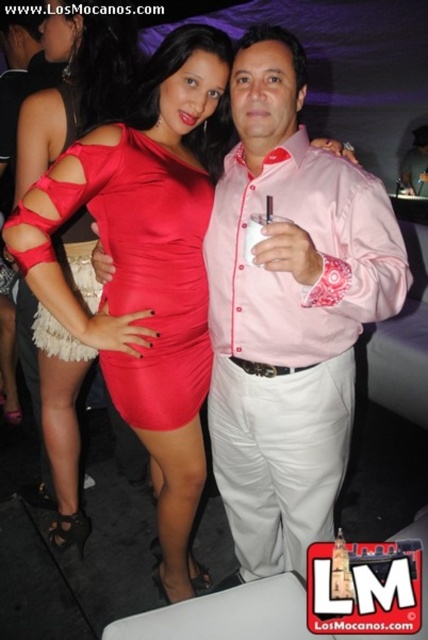
Is pink satin shirt at center to the right of satin dress at center from the viewer's perspective?

Correct, you'll find pink satin shirt at center to the right of satin dress at center.

This screenshot has height=640, width=428. Describe the element at coordinates (288, 310) in the screenshot. I see `pink satin shirt at center` at that location.

You are a GUI agent. You are given a task and a screenshot of the screen. Output one action in this format:
    pyautogui.click(x=<x>, y=<y>)
    Task: Click on the pink satin shirt at center
    The width and height of the screenshot is (428, 640).
    Given the screenshot: What is the action you would take?
    pyautogui.click(x=288, y=310)

Measure the distance between point (45, 140) and camera.

Point (45, 140) and camera are 5.37 feet apart.

Who is more forward, (17,180) or (249,260)?

Point (249,260) is in front.

I want to click on matte red dress at center, so click(x=79, y=259).

Is pink satin shirt at center positioned in front of matte red dress at center?

That is True.

Where is `pink satin shirt at center`? The width and height of the screenshot is (428, 640). pink satin shirt at center is located at coordinates (288, 310).